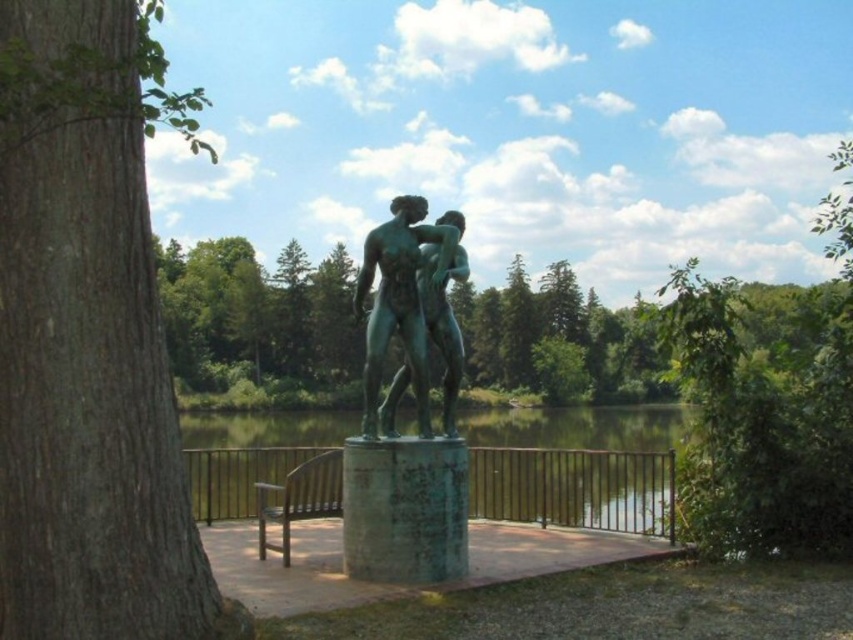
You are an artist planning to paint the scene. You need to decide which object, the green rough bark tree at left or the greenish reflective water at center, requires more detailed brushstrokes due to its texture. Based on the scene description, which object should you focus on?

The green rough bark tree at left has a rough texture, so you should focus more detailed brushstrokes on it compared to the smooth greenish reflective water at center.

You are an artist planning to sketch the scene from this image. You want to place the green rough bark tree at left in your drawing. Where should you position it on your canvas using coordinates?

The green rough bark tree at left should be positioned at coordinates approximately 0.531 on the x axis and 0.107 on the y axis.